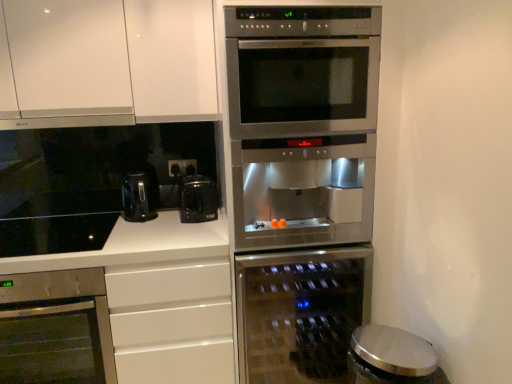
What is the approximate width of stainless steel oven at lower left, positioned as the second oven in right-to-left order?

stainless steel oven at lower left, positioned as the second oven in right-to-left order, is 60.99 centimeters wide.

What do you see at coordinates (300, 312) in the screenshot?
I see `stainless steel oven at center, which is the first oven from right to left` at bounding box center [300, 312].

The height and width of the screenshot is (384, 512). What are the coordinates of `white glossy countertop at lower left` in the screenshot? It's located at (122, 308).

Measure the distance between stainless steel oven at center, the first appliance from the back, and camera.

stainless steel oven at center, the first appliance from the back, and camera are 1.54 meters apart.

Find the location of a particular element. This screenshot has width=512, height=384. metallic silver trash can at lower right, which appears as the first appliance when viewed from the front is located at coordinates (392, 357).

The image size is (512, 384). In order to click on stainless steel oven at lower left, positioned as the second oven in right-to-left order in this screenshot , I will do `click(55, 328)`.

Does white glossy countertop at lower left have a lesser width compared to black glossy coffee maker at center?

No, white glossy countertop at lower left is not thinner than black glossy coffee maker at center.

Is white glossy countertop at lower left to the right of black glossy coffee maker at center from the viewer's perspective?

No, white glossy countertop at lower left is not to the right of black glossy coffee maker at center.

Can we say white glossy countertop at lower left lies outside black glossy coffee maker at center?

Yes, white glossy countertop at lower left is located beyond the bounds of black glossy coffee maker at center.

Between stainless steel oven at center, the first appliance from the back, and stainless steel oven at lower left, acting as the first oven starting from the left, which one has smaller width?

stainless steel oven at center, the first appliance from the back.

Is stainless steel oven at center, which is the 2th appliance from front to back, aimed at stainless steel oven at lower left, acting as the first oven starting from the left?

No, stainless steel oven at center, which is the 2th appliance from front to back, is not oriented towards stainless steel oven at lower left, acting as the first oven starting from the left.

Can you tell me how much stainless steel oven at center, the first appliance from the back, and stainless steel oven at lower left, positioned as the second oven in right-to-left order, differ in facing direction?

They differ by 0.00206 degrees in their facing directions.

In the scene shown: In the image, is stainless steel oven at center, the first appliance from the back, positioned in front of or behind stainless steel oven at lower left, acting as the first oven starting from the left?

stainless steel oven at center, the first appliance from the back, is in front of stainless steel oven at lower left, acting as the first oven starting from the left.

How far apart are black plastic coffee machine at center and black plastic electric outlet at center?

black plastic coffee machine at center and black plastic electric outlet at center are 8.47 inches apart.

From a real-world perspective, who is located lower, black plastic coffee machine at center or black plastic electric outlet at center?

From a 3D spatial view, black plastic coffee machine at center is below.

From the image's perspective, which is below, black plastic coffee machine at center or black plastic electric outlet at center?

black plastic coffee machine at center is shown below in the image.

Which is more to the left, black plastic coffee machine at center or black plastic electric outlet at center?

black plastic coffee machine at center.

Is point (221, 330) in front of point (60, 322)?

That is True.

Is white glossy countertop at lower left facing towards stainless steel oven at lower left, positioned as the second oven in right-to-left order?

Yes, white glossy countertop at lower left is turned towards stainless steel oven at lower left, positioned as the second oven in right-to-left order.

How different are the orientations of white glossy countertop at lower left and stainless steel oven at lower left, acting as the first oven starting from the left, in degrees?

There is a 0.00357-degree angle between the facing directions of white glossy countertop at lower left and stainless steel oven at lower left, acting as the first oven starting from the left.

Between white glossy countertop at lower left and white matte cabinet at upper left, which one has smaller size?

white matte cabinet at upper left is smaller.

Could you tell me if white glossy countertop at lower left is turned towards white matte cabinet at upper left?

No, white glossy countertop at lower left is not turned towards white matte cabinet at upper left.

Image resolution: width=512 pixels, height=384 pixels. I want to click on cabinetry above the white glossy countertop at lower left (from the image's perspective), so click(x=106, y=62).

Which point is more forward, [126,303] or [174,41]?

Point [126,303]

Which object is thinner, white glossy countertop at lower left or black plastic coffee machine at center?

Thinner between the two is black plastic coffee machine at center.

Is white glossy countertop at lower left facing away from black plastic coffee machine at center?

white glossy countertop at lower left is not turned away from black plastic coffee machine at center.

I want to click on coffee machine above the white glossy countertop at lower left (from a real-world perspective), so pos(140,193).

From the image's perspective, which one is positioned lower, white glossy countertop at lower left or black plastic coffee machine at center?

From the image's view, white glossy countertop at lower left is below.

From the image's perspective, which one is positioned lower, stainless steel oven at lower left, acting as the first oven starting from the left, or black plastic electric outlet at center?

stainless steel oven at lower left, acting as the first oven starting from the left.

Considering the relative sizes of stainless steel oven at lower left, acting as the first oven starting from the left, and black plastic electric outlet at center in the image provided, is stainless steel oven at lower left, acting as the first oven starting from the left, thinner than black plastic electric outlet at center?

Incorrect, the width of stainless steel oven at lower left, acting as the first oven starting from the left, is not less than that of black plastic electric outlet at center.

The height and width of the screenshot is (384, 512). Find the location of `oven on the left of black plastic electric outlet at center`. oven on the left of black plastic electric outlet at center is located at coordinates (55, 328).

Is stainless steel oven at lower left, acting as the first oven starting from the left, facing away from black plastic electric outlet at center?

No, black plastic electric outlet at center is not at the back of stainless steel oven at lower left, acting as the first oven starting from the left.

The width and height of the screenshot is (512, 384). What are the coordinates of `counter below the black glossy coffee maker at center (from a real-world perspective)` in the screenshot? It's located at (122, 308).

Which oven is the 2nd one when counting from the left side of the stainless steel oven at center, the first appliance from the back? Please provide its 2D coordinates.

[(55, 328)]

Which object lies nearer to the anchor point black plastic coffee machine at center, stainless steel oven at center, which is the first oven from right to left, or black glossy coffee maker at center?

Among the two, black glossy coffee maker at center is located nearer to black plastic coffee machine at center.

Estimate the real-world distances between objects in this image. Which object is closer to white glossy countertop at lower left, black glossy coffee maker at center or black plastic electric outlet at center?

Based on the image, black glossy coffee maker at center appears to be nearer to white glossy countertop at lower left.

Looking at the image, which one is located closer to black glass cooktop at lower left, stainless steel oven at center, which is the first oven from right to left, or white matte cabinet at upper left?

white matte cabinet at upper left is positioned closer to the anchor black glass cooktop at lower left.

When comparing their distances from stainless steel oven at lower left, positioned as the second oven in right-to-left order, does stainless steel oven at center, the first appliance from the back, or metallic silver trash can at lower right, marked as the 2th appliance in a back-to-front arrangement, seem further?

metallic silver trash can at lower right, marked as the 2th appliance in a back-to-front arrangement, lies further to stainless steel oven at lower left, positioned as the second oven in right-to-left order, than the other object.

When comparing their distances from stainless steel oven at center, the first appliance from the back, does black glass cooktop at lower left or metallic silver trash can at lower right, marked as the 2th appliance in a back-to-front arrangement, seem closer?

Based on the image, metallic silver trash can at lower right, marked as the 2th appliance in a back-to-front arrangement, appears to be nearer to stainless steel oven at center, the first appliance from the back.

When comparing their distances from stainless steel oven at lower left, acting as the first oven starting from the left, does black plastic electric outlet at center or black plastic coffee machine at center seem closer?

The object closer to stainless steel oven at lower left, acting as the first oven starting from the left, is black plastic coffee machine at center.

From the image, which object appears to be farther from metallic silver trash can at lower right, which appears as the first appliance when viewed from the front, stainless steel oven at center, which is the 2th appliance from front to back, or black plastic coffee machine at center?

black plastic coffee machine at center.

Which object lies further to the anchor point black plastic coffee machine at center, black glass cooktop at lower left or black glossy coffee maker at center?

black glass cooktop at lower left.

The image size is (512, 384). I want to click on electric outlet situated between black glass cooktop at lower left and black glossy coffee maker at center from left to right, so tap(181, 164).

Locate an element on the screen. This screenshot has width=512, height=384. coffee machine between black plastic electric outlet at center and stainless steel oven at center, the second oven viewed from the left, from top to bottom is located at coordinates (140, 193).

What are the coordinates of `coffee maker between black plastic electric outlet at center and white glossy countertop at lower left in the up-down direction` in the screenshot? It's located at (197, 199).

I want to click on coffee maker between black plastic electric outlet at center and stainless steel oven at lower left, positioned as the second oven in right-to-left order, vertically, so click(197, 199).